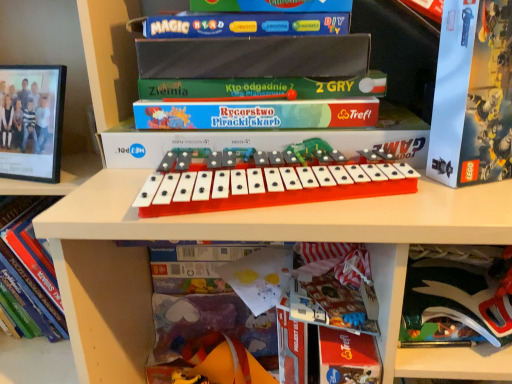
Question: Is point (323, 357) positioned closer to the camera than point (285, 322)?

Choices:
 (A) farther
 (B) closer

Answer: (B)

Question: From a real-world perspective, relative to hardcover book at center, which is counted as the third book, starting from the left, is red paper at lower center, the 1th paperback book from the bottom, vertically above or below?

Choices:
 (A) below
 (B) above

Answer: (A)

Question: Which of these objects is positioned farthest from the orange plastic musical keyboard at center?

Choices:
 (A) matte paper book at lower center, the 2th book in the right-to-left sequence
 (B) hardcover book at lower left, the third book positioned from the right
 (C) hardcover book at center, which appears as the first book when viewed from the right
 (D) matte black scissors at lower right, which is counted as the second paperback book, starting from the bottom
 (E) rubber duck at lower center

Answer: (B)

Question: Estimate the real-world distances between objects in this image. Which object is closer to the matte black scissors at lower right, the 3th paperback book viewed from the top?

Choices:
 (A) matte green board game at center, marked as the third paperback book in a bottom-to-top arrangement
 (B) matte paper book at lower center, the 2th book in the right-to-left sequence
 (C) white cardboard lego box at right, acting as the 1th paperback book starting from the top
 (D) rubber duck at lower center
 (E) orange plastic musical keyboard at center

Answer: (C)